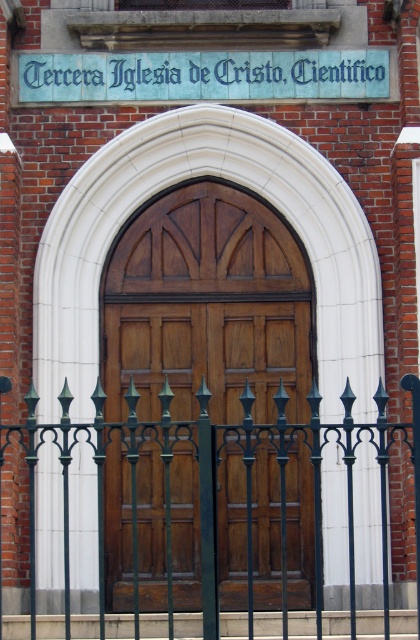
Is polished wood door at center to the right of green wrought iron fence at center from the viewer's perspective?

Incorrect, polished wood door at center is not on the right side of green wrought iron fence at center.

Does polished wood door at center have a greater width compared to green wrought iron fence at center?

No, polished wood door at center is not wider than green wrought iron fence at center.

Which is in front, point (257, 468) or point (15, 432)?

Point (257, 468) is more forward.

I want to click on polished wood door at center, so click(207, 307).

Does polished wood door at center appear on the right side of blue painted signboard at upper center?

Correct, you'll find polished wood door at center to the right of blue painted signboard at upper center.

Can you confirm if polished wood door at center is positioned above blue painted signboard at upper center?

Actually, polished wood door at center is below blue painted signboard at upper center.

The width and height of the screenshot is (420, 640). What do you see at coordinates (207, 307) in the screenshot? I see `polished wood door at center` at bounding box center [207, 307].

I want to click on polished wood door at center, so click(207, 307).

Between green wrought iron fence at center and blue painted signboard at upper center, which one appears on the left side from the viewer's perspective?

Result: From the viewer's perspective, blue painted signboard at upper center appears more on the left side.

Does green wrought iron fence at center have a lesser height compared to blue painted signboard at upper center?

No.

Which is behind, point (165, 515) or point (196, 72)?

Point (196, 72)

Locate an element on the screen. This screenshot has width=420, height=640. green wrought iron fence at center is located at coordinates (215, 484).